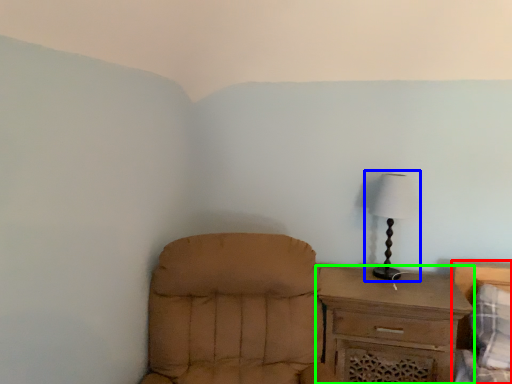
Question: Estimate the real-world distances between objects in this image. Which object is closer to bed (highlighted by a red box), lamp (highlighted by a blue box) or chest of drawers (highlighted by a green box)?

Choices:
 (A) lamp
 (B) chest of drawers

Answer: (B)